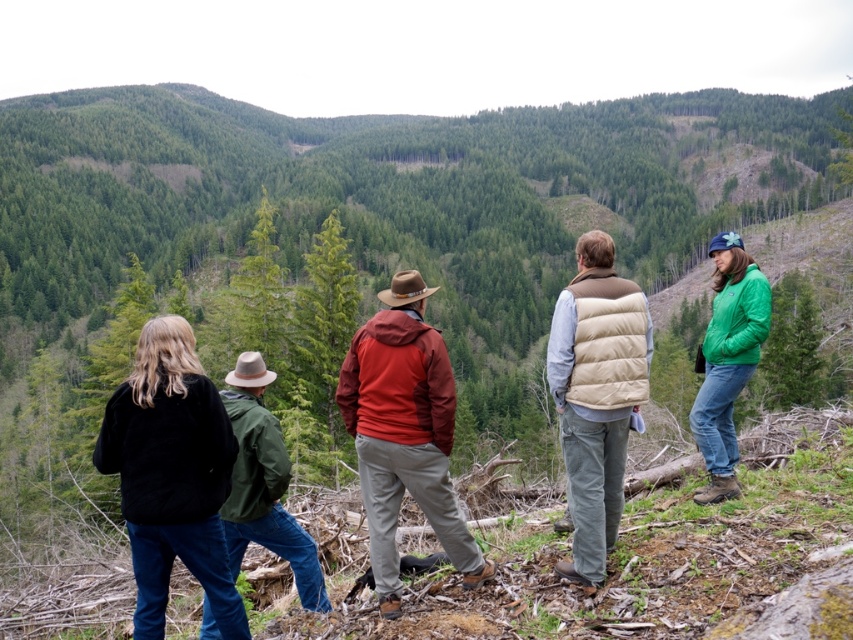
In the scene shown: Can you confirm if matte brown jacket at center is taller than beige down vest at center?

In fact, matte brown jacket at center may be shorter than beige down vest at center.

Is matte brown jacket at center above beige down vest at center?

Actually, matte brown jacket at center is below beige down vest at center.

Is point (381, 513) more distant than point (554, 344)?

No, (381, 513) is in front of (554, 344).

Where is `matte brown jacket at center`? This screenshot has height=640, width=853. matte brown jacket at center is located at coordinates (404, 433).

Looking at this image, who is shorter, matte brown jacket at center or green matte jacket at right?

matte brown jacket at center is shorter.

Which of these two, matte brown jacket at center or green matte jacket at right, stands taller?

green matte jacket at right

What do you see at coordinates (404, 433) in the screenshot? I see `matte brown jacket at center` at bounding box center [404, 433].

This screenshot has width=853, height=640. Find the location of `matte brown jacket at center`. matte brown jacket at center is located at coordinates (404, 433).

Does black fleece jacket at lower left have a lesser width compared to green matte jacket at center-left?

In fact, black fleece jacket at lower left might be wider than green matte jacket at center-left.

Does point (161, 419) come closer to viewer compared to point (270, 445)?

That is True.

Where is `black fleece jacket at lower left`? black fleece jacket at lower left is located at coordinates (171, 474).